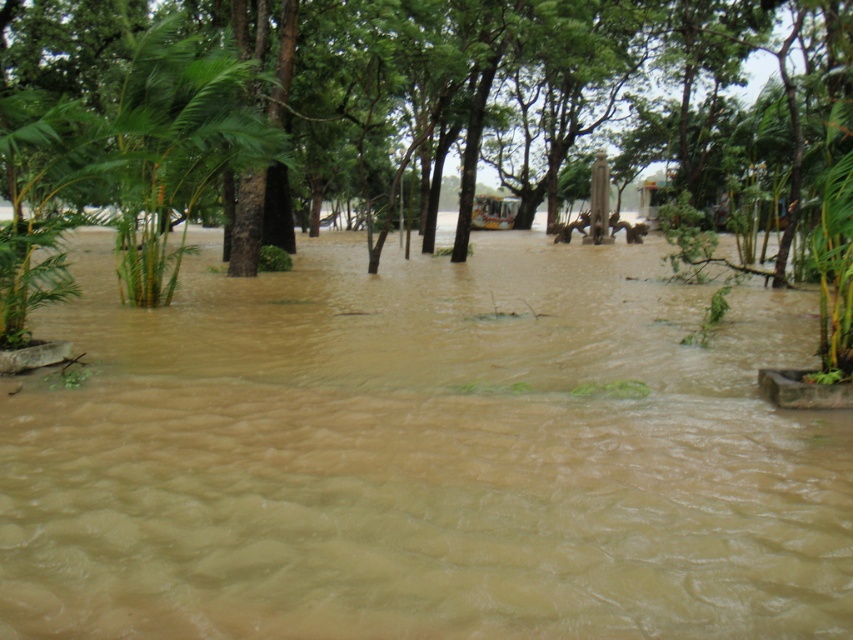
Is brown muddy water at center smaller than brown wood tree at center?

Correct, brown muddy water at center occupies less space than brown wood tree at center.

Which is behind, point (555, 524) or point (28, 26)?

The point (28, 26) is more distant.

You are a GUI agent. You are given a task and a screenshot of the screen. Output one action in this format:
    pyautogui.click(x=<x>, y=<y>)
    Task: Click on the brown muddy water at center
    The width and height of the screenshot is (853, 640).
    Given the screenshot: What is the action you would take?
    pyautogui.click(x=422, y=454)

Locate an element on the screen. This screenshot has height=640, width=853. brown wood tree at center is located at coordinates (427, 102).

Who is positioned more to the left, brown wood tree at center or green leafy palm tree at left?

green leafy palm tree at left is more to the left.

Between point (817, 113) and point (134, 88), which one is positioned in front?

Point (134, 88)

Where is `brown wood tree at center`? brown wood tree at center is located at coordinates (427, 102).

Locate an element on the screen. brown muddy water at center is located at coordinates (422, 454).

Is brown muddy water at center smaller than green leafy palm tree at left?

Yes, brown muddy water at center is smaller than green leafy palm tree at left.

This screenshot has height=640, width=853. What are the coordinates of `brown muddy water at center` in the screenshot? It's located at (422, 454).

The image size is (853, 640). I want to click on brown muddy water at center, so click(422, 454).